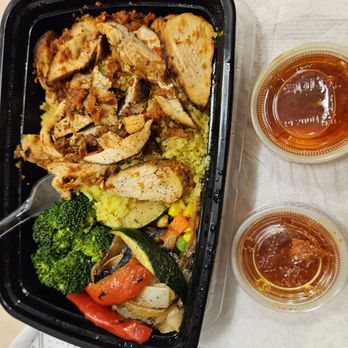
Locate an element on the screen. paper towel is located at coordinates (285, 14).